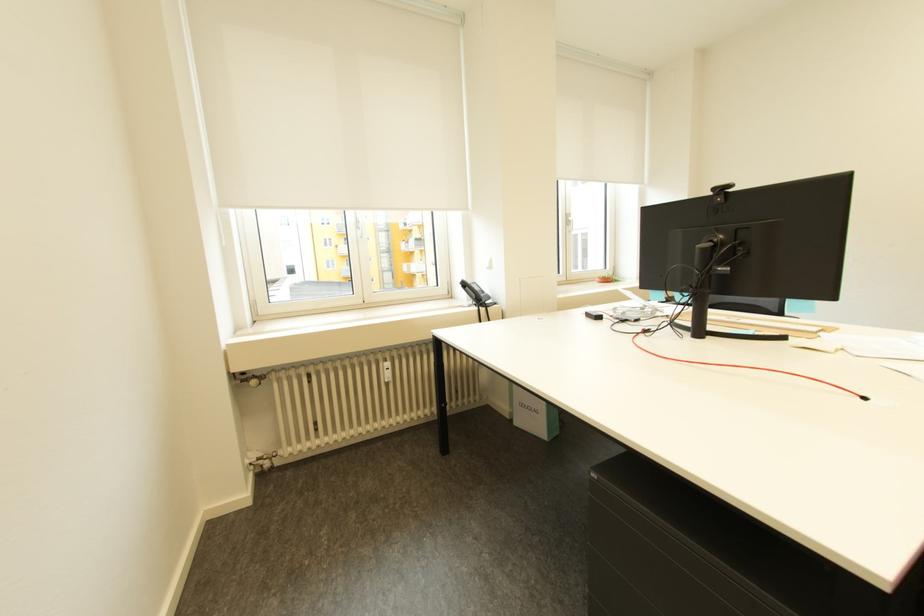
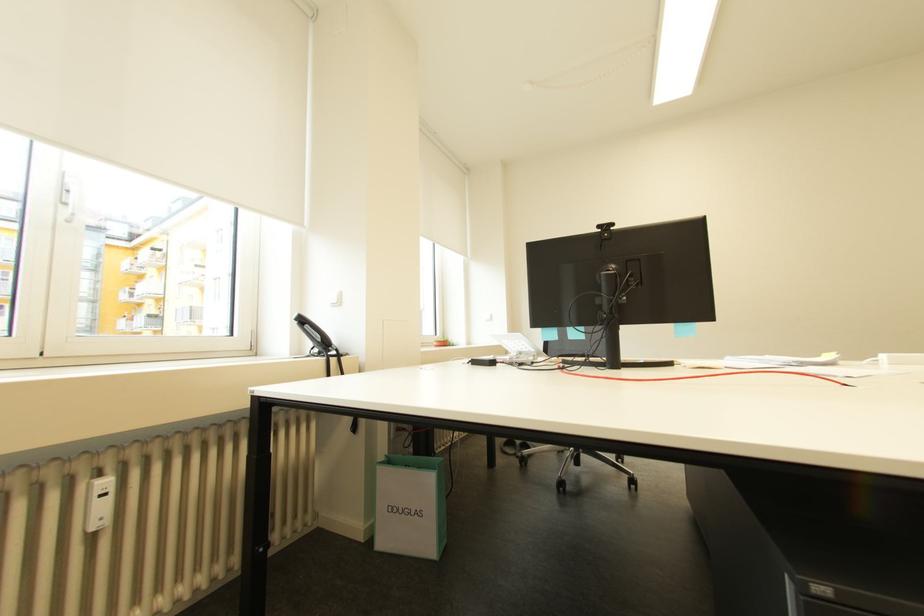
Question: The camera is either moving clockwise (left) or counter-clockwise (right) around the object. The first image is from the beginning of the video and the second image is from the end. Is the camera moving left or right when shooting the video?

Choices:
 (A) Left
 (B) Right

Answer: (A)